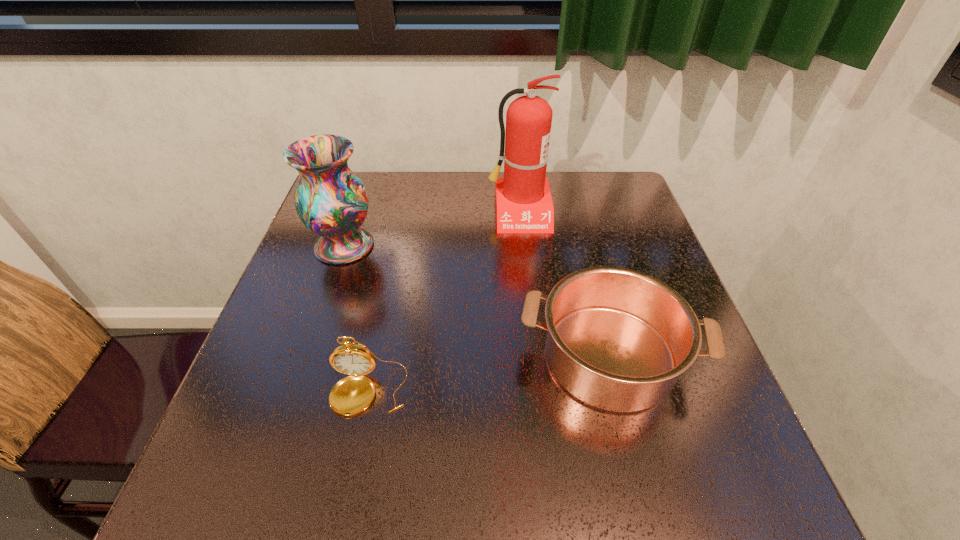
Locate an element on the screen. The image size is (960, 540). the tallest object is located at coordinates (524, 204).

This screenshot has width=960, height=540. Find the location of `vase`. vase is located at coordinates (331, 201).

This screenshot has width=960, height=540. Find the location of `pocket watch`. pocket watch is located at coordinates (352, 394).

Identify the location of saucepan. The image size is (960, 540). (617, 339).

The height and width of the screenshot is (540, 960). In order to click on free space located 0.200m on the front-facing side of the tallest object in this screenshot , I will do `click(527, 287)`.

Identify the location of free region located on the back of the third shortest object. Image resolution: width=960 pixels, height=540 pixels. (359, 203).

Locate an element on the screen. This screenshot has height=540, width=960. free space located 0.070m on the left of the saucepan is located at coordinates (483, 356).

Find the location of a particular element. This screenshot has height=540, width=960. object that is at the far edge is located at coordinates (524, 204).

Identify the location of object present at the left edge. The height and width of the screenshot is (540, 960). (331, 201).

This screenshot has height=540, width=960. What are the coordinates of `object that is at the right edge` in the screenshot? It's located at (617, 339).